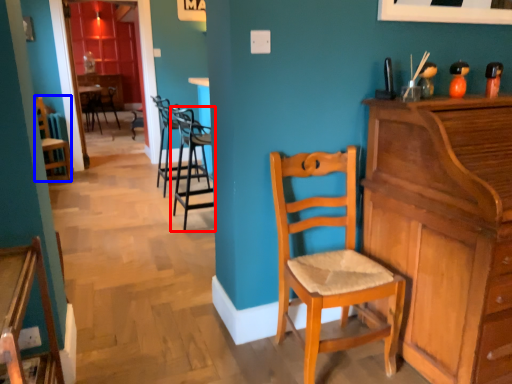
Question: Which point is further to the camera, chair (highlighted by a red box) or chair (highlighted by a blue box)?

Choices:
 (A) chair
 (B) chair

Answer: (B)